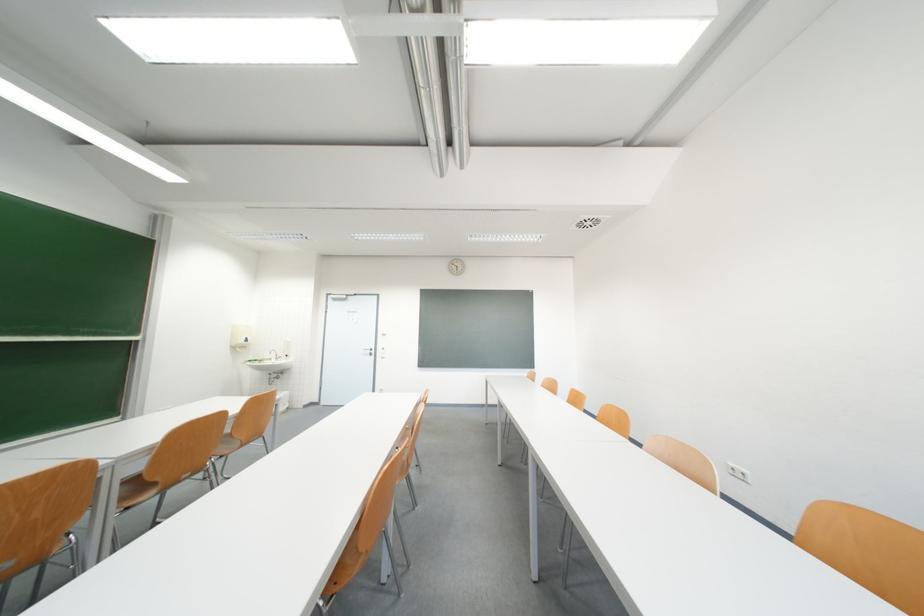
In order to click on sink faucet handle in this screenshot , I will do `click(273, 354)`.